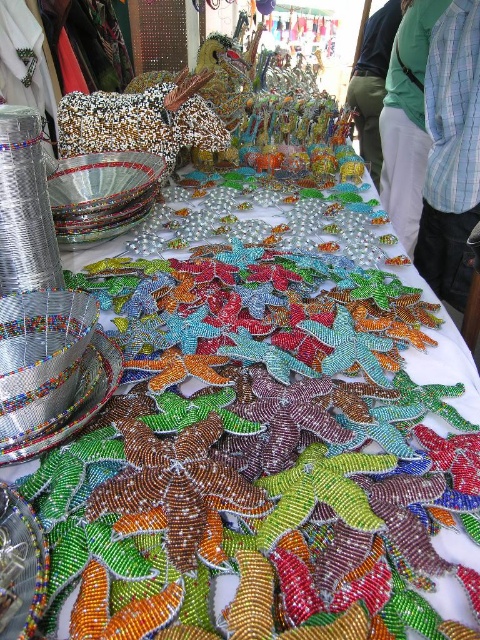
Question: Can you confirm if blue plaid shirt at upper right is wider than green fabric at upper center?

Choices:
 (A) yes
 (B) no

Answer: (B)

Question: Which point is closer to the camera taking this photo?

Choices:
 (A) (388, 45)
 (B) (451, 237)
 (C) (410, 8)

Answer: (B)

Question: Does blue plaid shirt at upper right have a greater width compared to green fabric at upper center?

Choices:
 (A) no
 (B) yes

Answer: (A)

Question: Among these points, which one is nearest to the camera?

Choices:
 (A) click(398, 150)
 (B) click(379, 172)
 (C) click(436, 28)

Answer: (C)

Question: Can you confirm if blue plaid shirt at upper right is positioned to the right of green fabric at upper center?

Choices:
 (A) no
 (B) yes

Answer: (A)

Question: Which of the following is the closest to the observer?

Choices:
 (A) (412, 221)
 (B) (396, 1)
 (C) (436, 260)

Answer: (C)